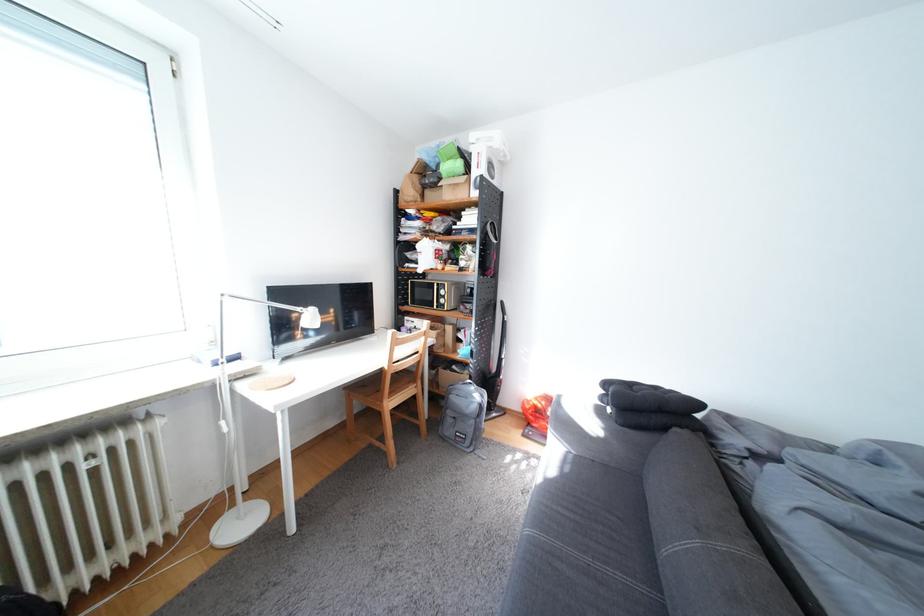
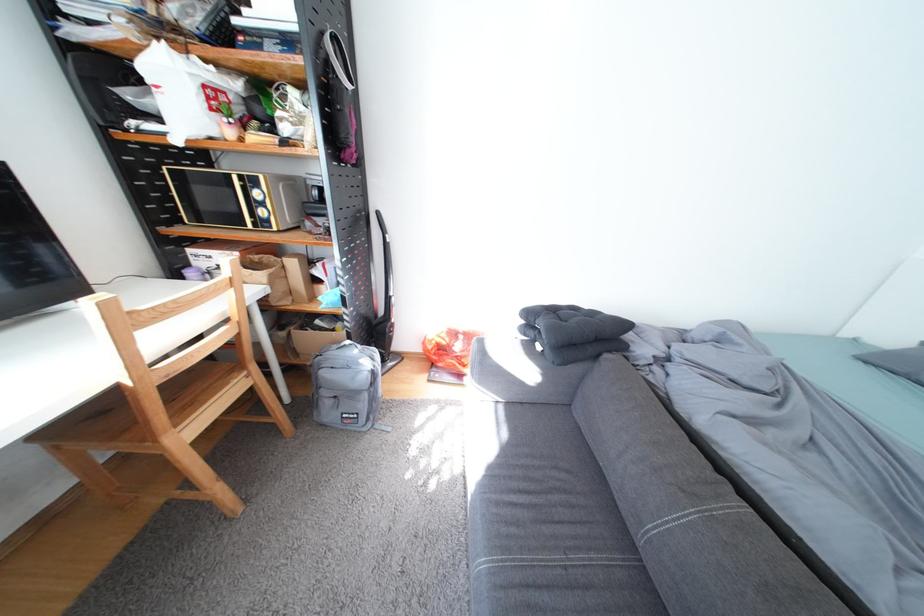
Where in the second image is the point corresponding to [622,411] from the first image?

(552, 347)